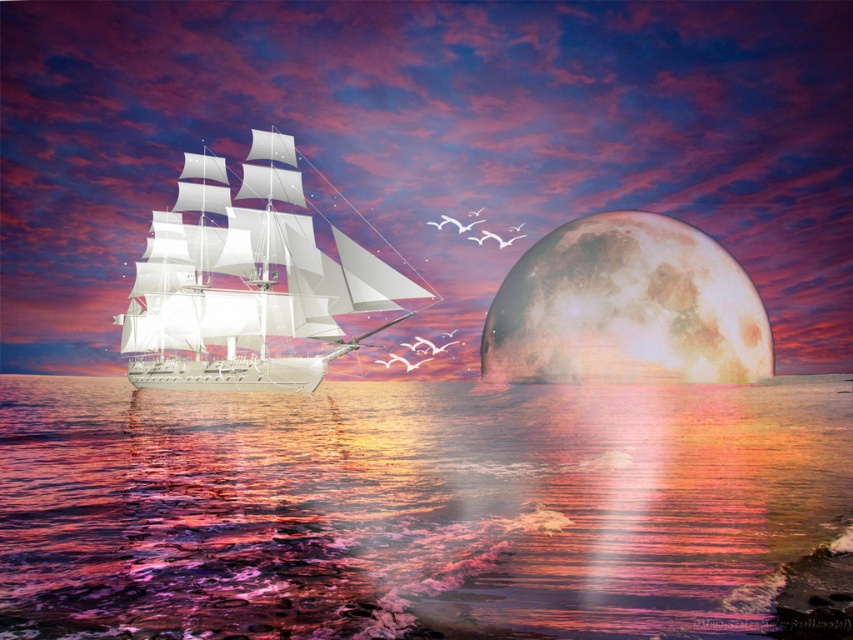
Can you confirm if white glossy sailboat at left is taller than rustic textured moon at right?

Incorrect, white glossy sailboat at left's height is not larger of rustic textured moon at right's.

Does white glossy sailboat at left appear on the left side of rustic textured moon at right?

Correct, you'll find white glossy sailboat at left to the left of rustic textured moon at right.

Is point (172, 368) farther from camera compared to point (753, 342)?

No.

At what (x,y) coordinates should I click in order to perform the action: click on white glossy sailboat at left. Please return your answer as a coordinate pair (x, y). This screenshot has height=640, width=853. Looking at the image, I should click on (251, 285).

Can you confirm if shiny metallic water at lower center is smaller than rustic textured moon at right?

Actually, shiny metallic water at lower center might be larger than rustic textured moon at right.

Between shiny metallic water at lower center and rustic textured moon at right, which one has less height?

Standing shorter between the two is shiny metallic water at lower center.

Is point (361, 451) positioned behind point (517, 314)?

No, it is not.

At what (x,y) coordinates should I click in order to perform the action: click on shiny metallic water at lower center. Please return your answer as a coordinate pair (x, y). The height and width of the screenshot is (640, 853). Looking at the image, I should click on (410, 506).

Between shiny metallic water at lower center and white glossy sailboat at left, which one appears on the right side from the viewer's perspective?

Positioned to the right is shiny metallic water at lower center.

Is the position of shiny metallic water at lower center more distant than that of white glossy sailboat at left?

No, shiny metallic water at lower center is closer to the viewer.

What do you see at coordinates (410, 506) in the screenshot? I see `shiny metallic water at lower center` at bounding box center [410, 506].

At what (x,y) coordinates should I click in order to perform the action: click on shiny metallic water at lower center. Please return your answer as a coordinate pair (x, y). This screenshot has width=853, height=640. Looking at the image, I should click on (410, 506).